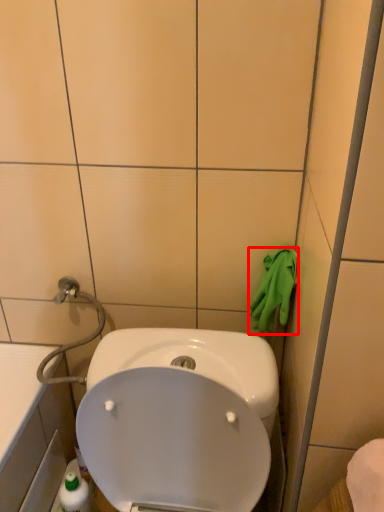
Question: From the image's perspective, what is the correct spatial relationship of hand towel (annotated by the red box) in relation to glass door?

Choices:
 (A) above
 (B) below

Answer: (A)